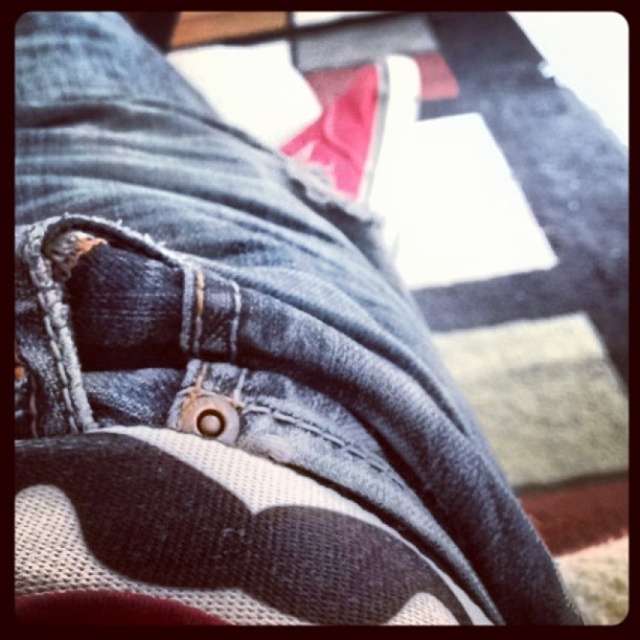
Who is positioned more to the left, black canvas shoe at lower center or matte pink fabric shoe at center?

From the viewer's perspective, black canvas shoe at lower center appears more on the left side.

Does point (346, 595) come farther from viewer compared to point (390, 83)?

No, it is in front of (390, 83).

This screenshot has width=640, height=640. What are the coordinates of `black canvas shoe at lower center` in the screenshot? It's located at (216, 532).